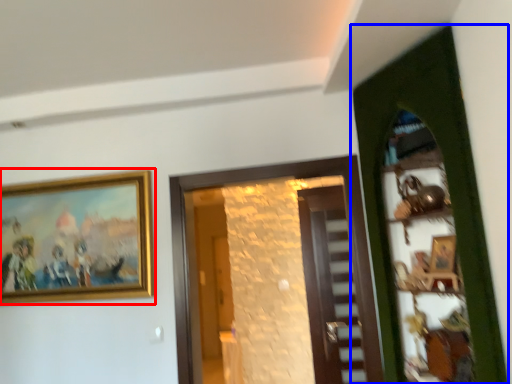
Question: Which of the following is the closest to the observer, picture frame (highlighted by a red box) or door (highlighted by a blue box)?

Choices:
 (A) picture frame
 (B) door

Answer: (B)